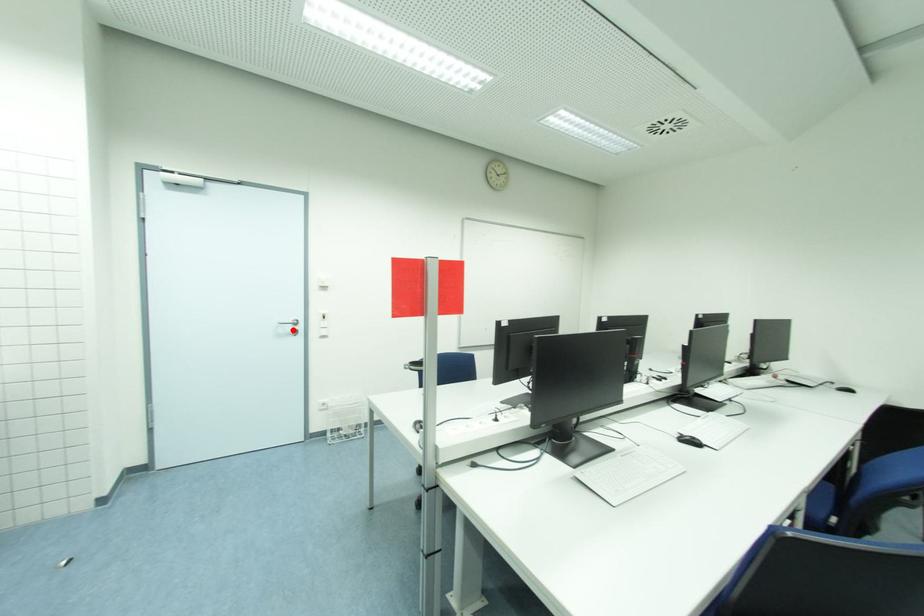
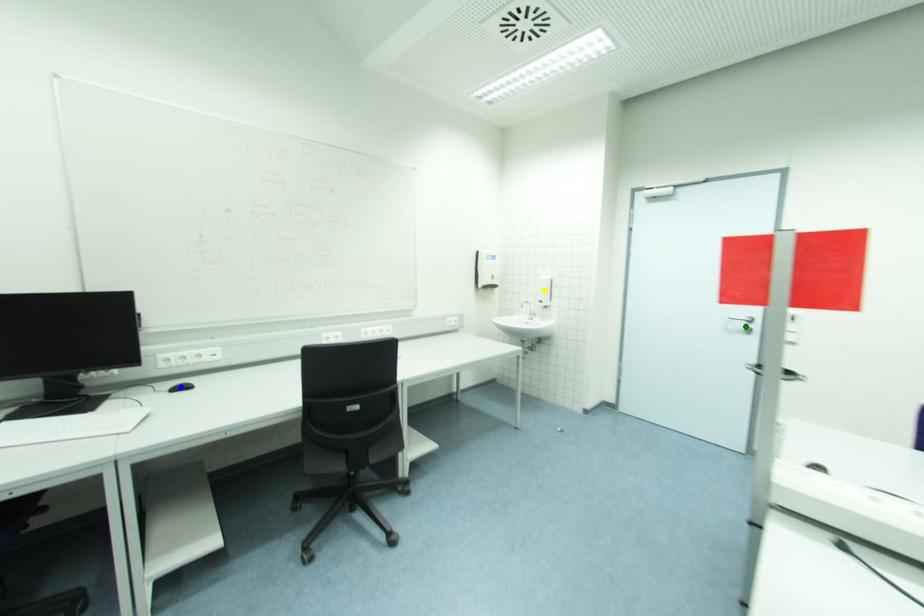
Question: I am providing you with two images of the same scene from different viewpoints. A red point is marked on the first image. You are given multiple points on the second image. Which mark in image 2 goes with the point in image 1?

Choices:
 (A) blue point
 (B) green point
 (C) yellow point

Answer: (B)